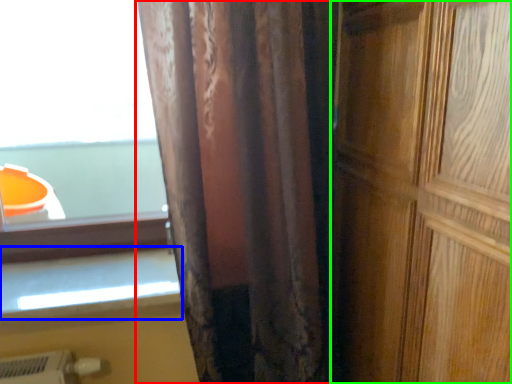
Question: Which object is positioned farthest from curtain (highlighted by a red box)? Select from window sill (highlighted by a blue box) and door (highlighted by a green box).

Choices:
 (A) window sill
 (B) door

Answer: (A)